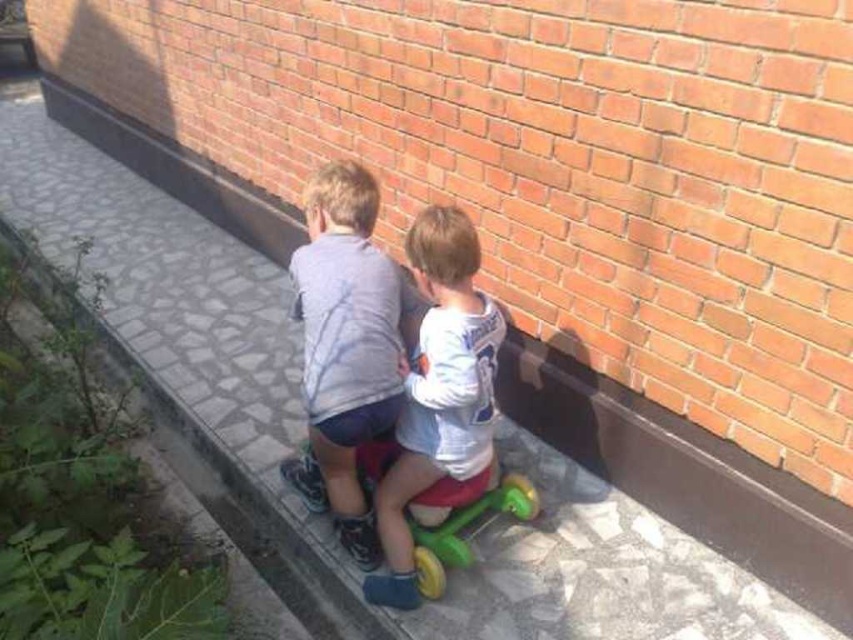
This screenshot has width=853, height=640. Identify the location of light gray cotton shirt at center. (346, 348).

Is point (357, 522) in front of point (474, 380)?

No.

Measure the distance between light gray cotton shirt at center and camera.

The distance of light gray cotton shirt at center from camera is 6.03 feet.

Find the location of a particular element. Image resolution: width=853 pixels, height=640 pixels. light gray cotton shirt at center is located at coordinates (346, 348).

Is the position of light gray cotton shirt at center more distant than that of green plastic tricycle at lower center?

No.

Between point (300, 269) and point (506, 480), which one is positioned behind?

Point (506, 480)

Identify the location of light gray cotton shirt at center. Image resolution: width=853 pixels, height=640 pixels. (346, 348).

Who is positioned more to the left, white matte shirt at center or green plastic tricycle at lower center?

Positioned to the left is white matte shirt at center.

Which is in front, point (477, 260) or point (492, 493)?

Point (477, 260)

Find the location of a particular element. white matte shirt at center is located at coordinates (437, 394).